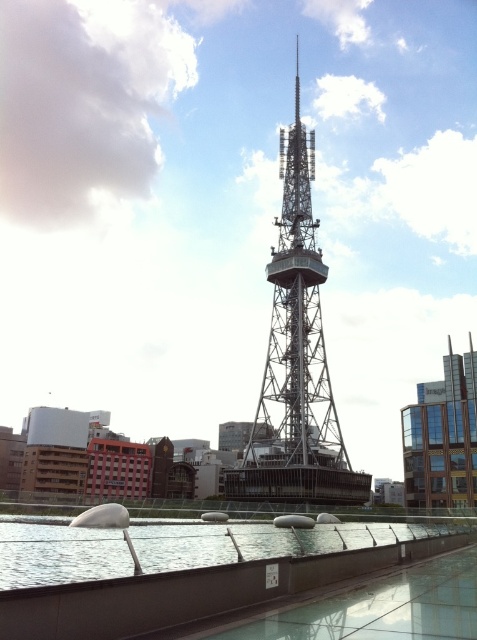
You are standing at a viewpoint 300 feet away from the metallic lattice tower at center. Can you safely walk closer to get a better view without exceeding the recommended safety distance of 300 feet?

The metallic lattice tower at center and viewer are 305.71 feet apart. Since you are currently 300 feet away, you can move 5.71 feet closer to reach the exact recommended distance. However, if the safety guideline strictly prohibits going beyond 300 feet, then moving closer would not be advisable.

You are standing in the urban area and want to take a photo of the metallic lattice tower at center and the clear glass water at lower center. Which object should you focus on first to ensure both are in sharp focus?

You should focus on the metallic lattice tower at center first because it is closer to you than the clear glass water at lower center, so focusing on the closer object will help ensure both are in focus.

You are standing at the center of the image. Which direction should you look to see the metallic lattice tower at center?

The metallic lattice tower at center is already at the center of the image, so you are already facing it directly.